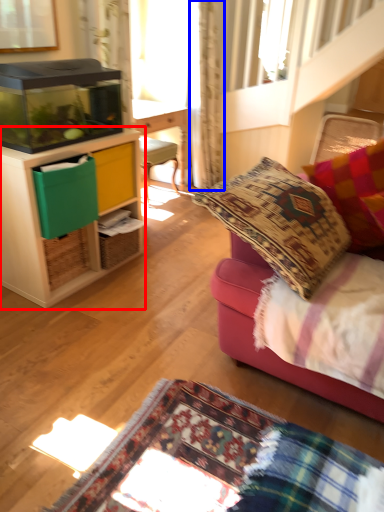
Question: Which object appears closest to the camera in this image, cabinetry (highlighted by a red box) or curtain (highlighted by a blue box)?

Choices:
 (A) cabinetry
 (B) curtain

Answer: (A)